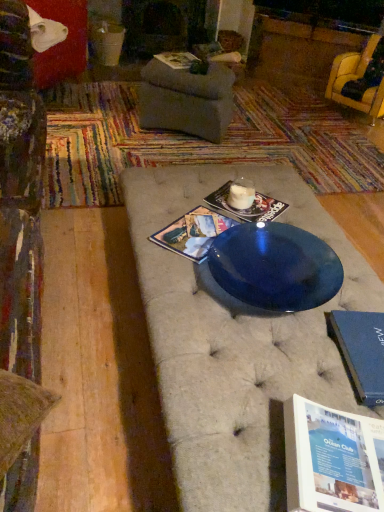
Image resolution: width=384 pixels, height=512 pixels. I want to click on vacant area that lies to the right of gray fabric footrest at center, so click(x=268, y=132).